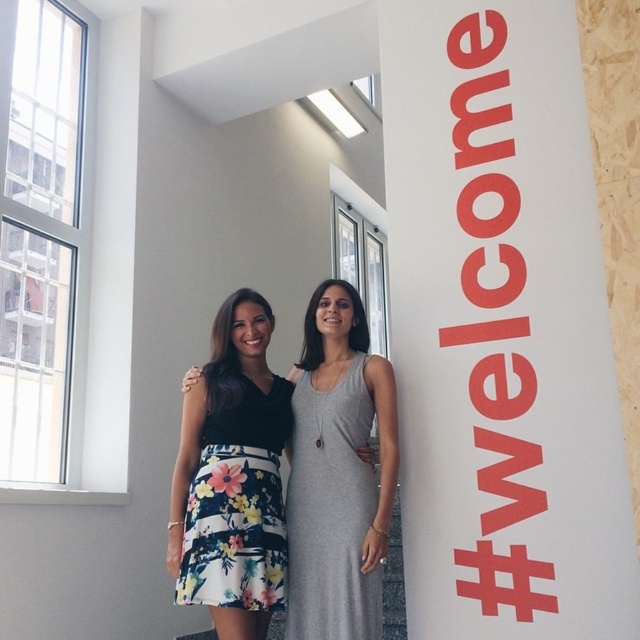
Can you confirm if white smooth pillar at upper center is positioned to the left of floral print fabric dress at center?

Incorrect, white smooth pillar at upper center is not on the left side of floral print fabric dress at center.

Between white smooth pillar at upper center and floral print fabric dress at center, which one appears on the left side from the viewer's perspective?

Positioned to the left is floral print fabric dress at center.

Is point (492, 28) positioned before point (260, 412)?

That is False.

At what (x,y) coordinates should I click in order to perform the action: click on white smooth pillar at upper center. Please return your answer as a coordinate pair (x, y). Looking at the image, I should click on (500, 328).

Who is lower down, floral print skirt at center or gray matte dress at center?

gray matte dress at center is lower down.

Is point (301, 435) farther from camera compared to point (339, 548)?

Yes, it is.

At what (x,y) coordinates should I click in order to perform the action: click on floral print skirt at center. Please return your answer as a coordinate pair (x, y). The height and width of the screenshot is (640, 640). Looking at the image, I should click on (339, 474).

Is white smooth pillar at upper center thinner than gray matte dress at center?

No.

Does white smooth pillar at upper center have a lesser height compared to gray matte dress at center?

No, white smooth pillar at upper center is not shorter than gray matte dress at center.

Image resolution: width=640 pixels, height=640 pixels. What are the coordinates of `white smooth pillar at upper center` in the screenshot? It's located at (500, 328).